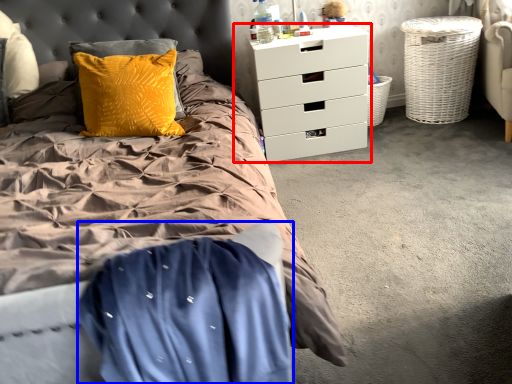
Question: Which point is closer to the camera, chest of drawers (highlighted by a red box) or blanket (highlighted by a blue box)?

Choices:
 (A) chest of drawers
 (B) blanket

Answer: (B)